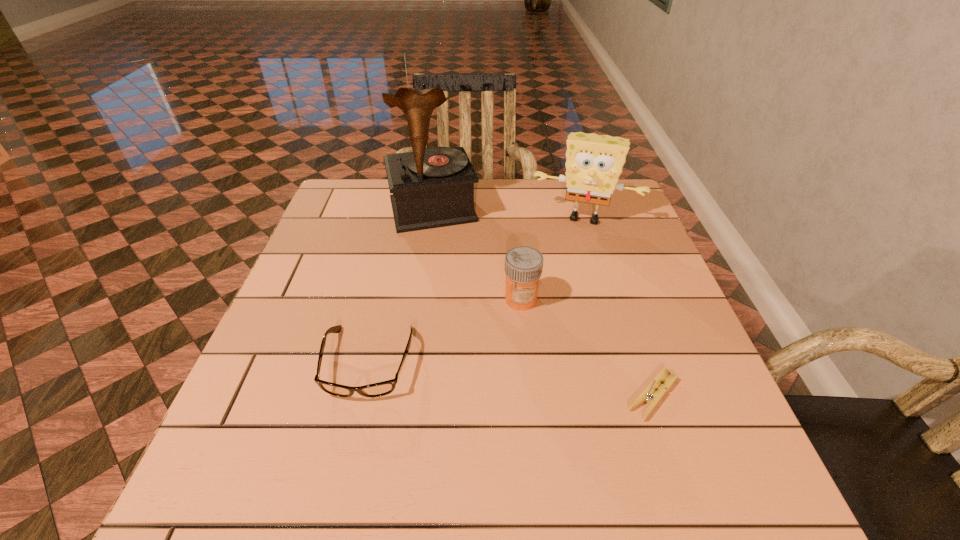
Locate an element on the screen. The height and width of the screenshot is (540, 960). free area in between the third object from right to left and the fourth shortest object is located at coordinates (553, 258).

You are a GUI agent. You are given a task and a screenshot of the screen. Output one action in this format:
    pyautogui.click(x=<x>, y=<y>)
    Task: Click on the vacant area that lies between the tallest object and the spectacles
    This screenshot has height=540, width=960.
    Given the screenshot: What is the action you would take?
    pyautogui.click(x=400, y=286)

The image size is (960, 540). I want to click on vacant area between the clothespin and the spectacles, so click(511, 379).

This screenshot has height=540, width=960. I want to click on object that is the third closest one to the third shortest object, so click(433, 187).

Identify the location of object that ranks as the closest to the tallest object. (594, 163).

The height and width of the screenshot is (540, 960). What are the coordinates of `free space that satisfies the following two spatial constraints: 1. on the front side of the phonograph_record; 2. on the right side of the third shortest object` in the screenshot? It's located at (420, 299).

Locate an element on the screen. Image resolution: width=960 pixels, height=540 pixels. vacant area that satisfies the following two spatial constraints: 1. on the front-facing side of the clothespin; 2. on the right side of the fourth tallest object is located at coordinates (361, 396).